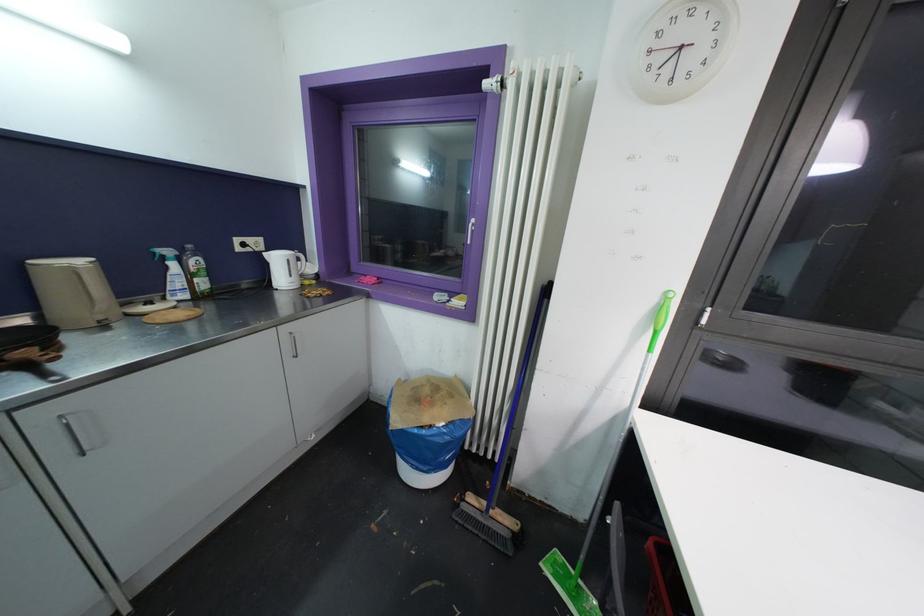
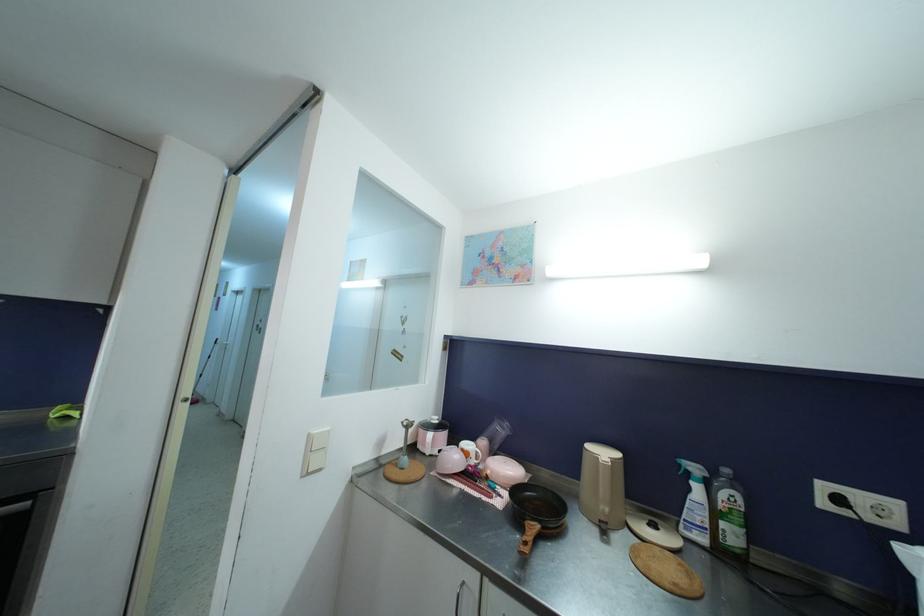
Question: The camera is either moving clockwise (left) or counter-clockwise (right) around the object. The first image is from the beginning of the video and the second image is from the end. Is the camera moving left or right when shooting the video?

Choices:
 (A) Left
 (B) Right

Answer: (B)